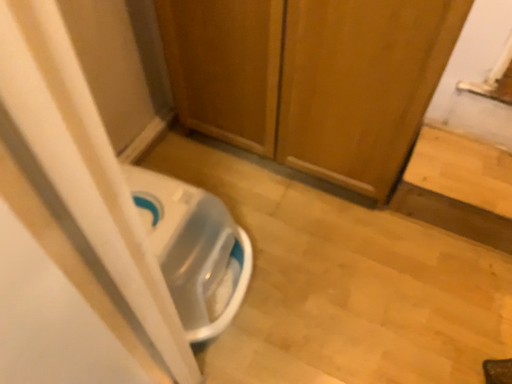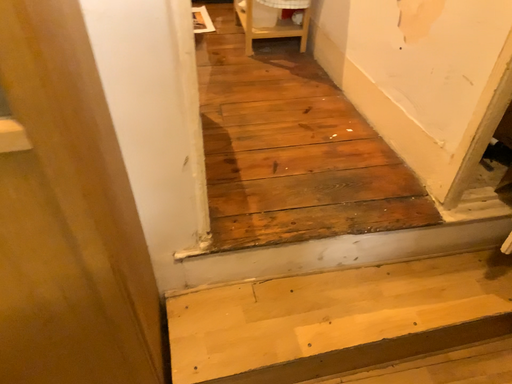
Question: Which way did the camera rotate in the video?

Choices:
 (A) rotated left
 (B) rotated right

Answer: (B)